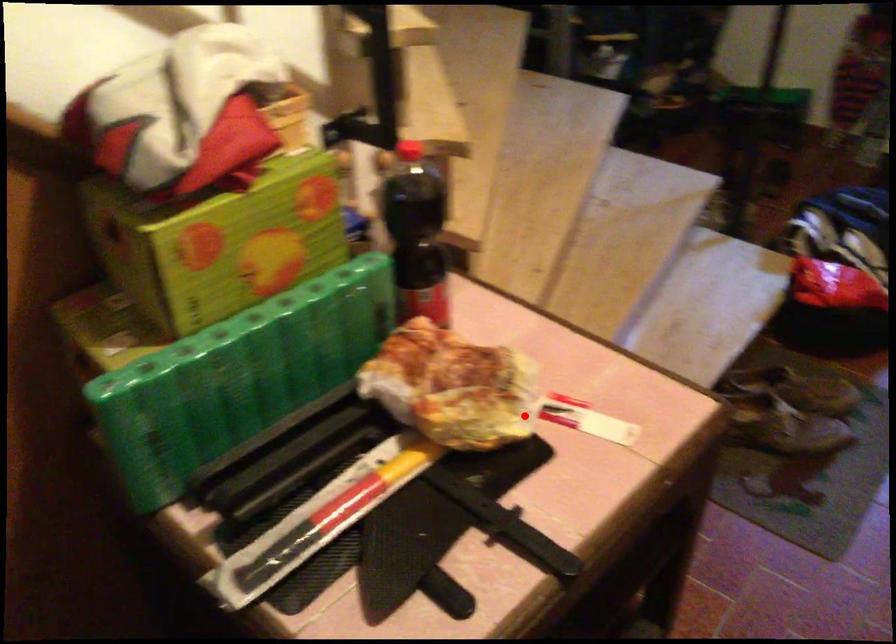
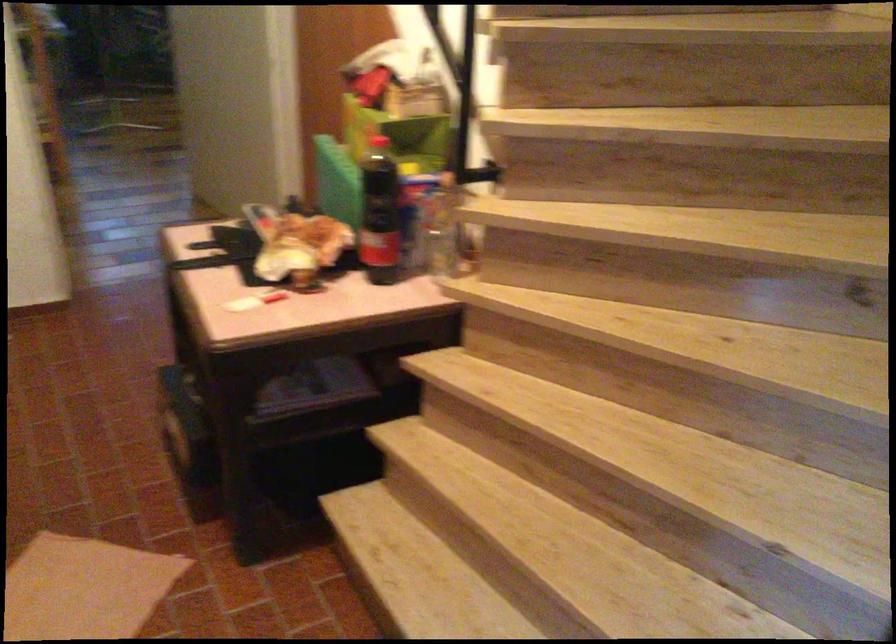
Locate, in the second image, the point that corresponds to the highlighted location in the first image.

(280, 292)